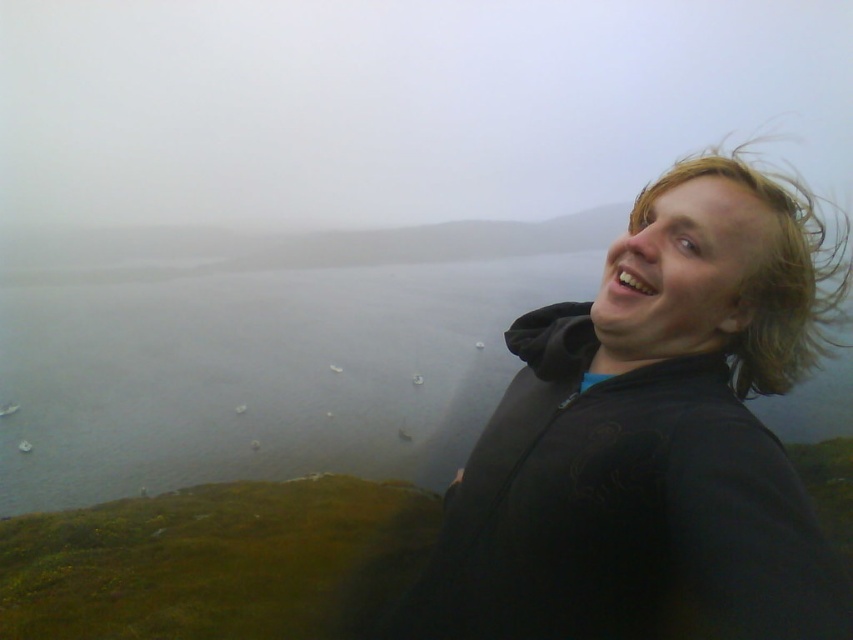
I want to click on black matte jacket at upper right, so click(650, 440).

Consider the image. Does black matte jacket at upper right have a greater width compared to blondehair texture at right?

Indeed, black matte jacket at upper right has a greater width compared to blondehair texture at right.

The height and width of the screenshot is (640, 853). In order to click on black matte jacket at upper right in this screenshot , I will do `click(650, 440)`.